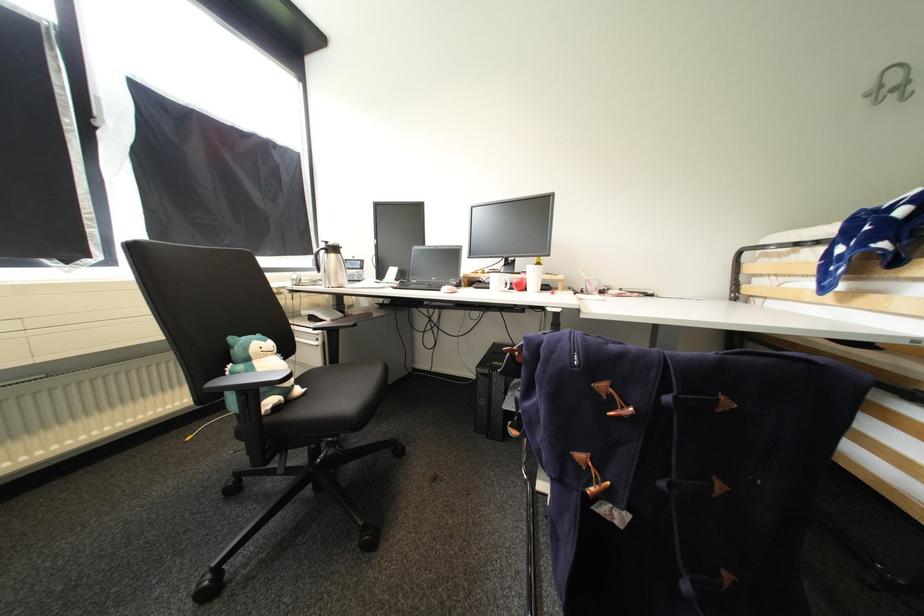
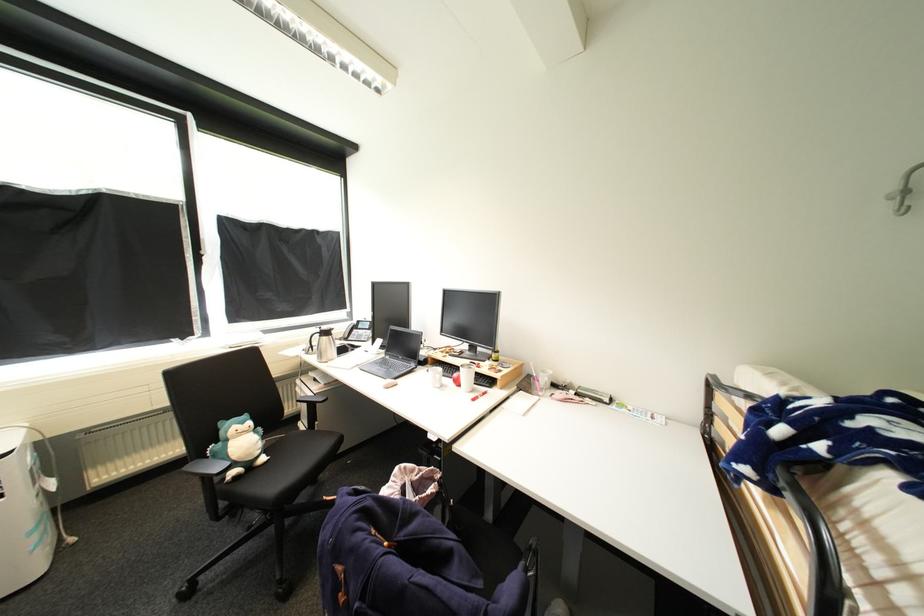
Find the pixel in the second image that matches (x=306, y=391) in the first image.

(270, 460)